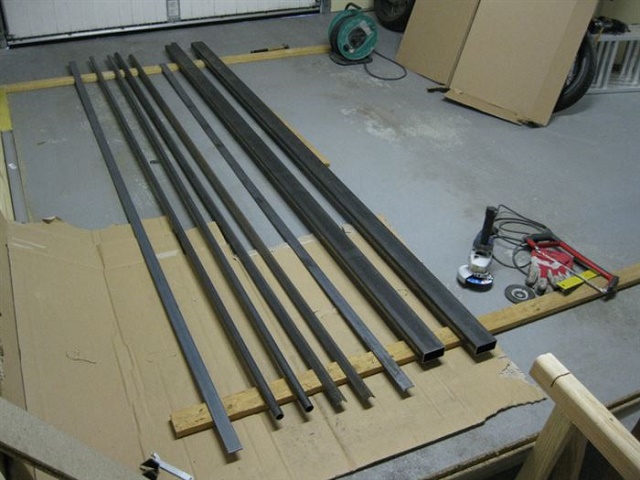
Locate an element on the screen. The image size is (640, 480). white door is located at coordinates (84, 8).